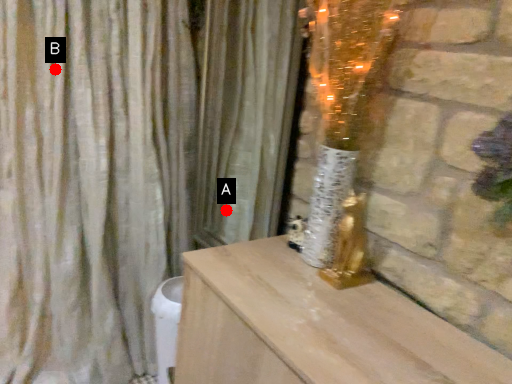
Question: Two points are circled on the image, labeled by A and B beside each circle. Which point is farther to the camera?

Choices:
 (A) A is further
 (B) B is further

Answer: (A)